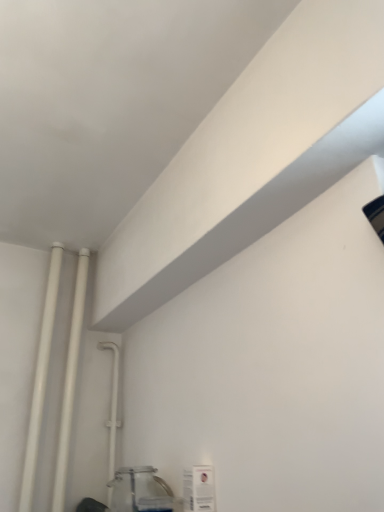
The height and width of the screenshot is (512, 384). What are the coordinates of `clear glass jar at lower left` in the screenshot? It's located at (139, 490).

What is the approximate height of white glossy pipes at left, the 2th pipe when ordered from right to left?

It is 36.51 inches.

Measure the distance between white matte pipe at left, marked as the first pipe in a left-to-right arrangement, and camera.

white matte pipe at left, marked as the first pipe in a left-to-right arrangement, and camera are 1.32 meters apart from each other.

The height and width of the screenshot is (512, 384). Find the location of `white plastic pipe at upper left, placed as the 3th pipe when sorted from left to right`. white plastic pipe at upper left, placed as the 3th pipe when sorted from left to right is located at coordinates (112, 405).

Locate an element on the screen. clear glass jar at lower left is located at coordinates (139, 490).

From a real-world perspective, is white glossy pipes at left, positioned as the second pipe in left-to-right order, over white plastic pipe at upper left, placed as the 3th pipe when sorted from left to right?

Yes.

What's the angular difference between white glossy pipes at left, positioned as the second pipe in left-to-right order, and white plastic pipe at upper left, marked as the first pipe in a right-to-left arrangement,'s facing directions?

The angle between the facing direction of white glossy pipes at left, positioned as the second pipe in left-to-right order, and the facing direction of white plastic pipe at upper left, marked as the first pipe in a right-to-left arrangement, is 2.59 degrees.

Which object is further away from the camera taking this photo, white glossy pipes at left, the 2th pipe when ordered from right to left, or white plastic pipe at upper left, placed as the 3th pipe when sorted from left to right?

white plastic pipe at upper left, placed as the 3th pipe when sorted from left to right, is more distant.

From the picture: Is clear glass jar at lower left situated inside white plastic pipe at upper left, marked as the first pipe in a right-to-left arrangement, or outside?

clear glass jar at lower left is spatially situated outside white plastic pipe at upper left, marked as the first pipe in a right-to-left arrangement.

Does clear glass jar at lower left have a lesser height compared to white plastic pipe at upper left, marked as the first pipe in a right-to-left arrangement?

Yes, clear glass jar at lower left is shorter than white plastic pipe at upper left, marked as the first pipe in a right-to-left arrangement.

Is clear glass jar at lower left bigger than white plastic pipe at upper left, marked as the first pipe in a right-to-left arrangement?

Result: Correct, clear glass jar at lower left is larger in size than white plastic pipe at upper left, marked as the first pipe in a right-to-left arrangement.

Can you confirm if white glossy pipes at left, positioned as the second pipe in left-to-right order, is positioned to the right of clear glass jar at lower left?

Incorrect, white glossy pipes at left, positioned as the second pipe in left-to-right order, is not on the right side of clear glass jar at lower left.

From a real-world perspective, which is physically above, white glossy pipes at left, the 2th pipe when ordered from right to left, or clear glass jar at lower left?

From a 3D spatial view, white glossy pipes at left, the 2th pipe when ordered from right to left, is above.

Can you tell me how much white glossy pipes at left, positioned as the second pipe in left-to-right order, and clear glass jar at lower left differ in facing direction?

88.2 degrees separate the facing orientations of white glossy pipes at left, positioned as the second pipe in left-to-right order, and clear glass jar at lower left.

Are white glossy pipes at left, positioned as the second pipe in left-to-right order, and clear glass jar at lower left making contact?

They are not placed beside each other.

Does white matte pipe at left, marked as the first pipe in a left-to-right arrangement, turn towards white plastic pipe at upper left, placed as the 3th pipe when sorted from left to right?

No, white matte pipe at left, marked as the first pipe in a left-to-right arrangement, is not facing towards white plastic pipe at upper left, placed as the 3th pipe when sorted from left to right.

Is point (34, 443) positioned in front of point (109, 488)?

Yes, it is.

From the image's perspective, which one is positioned lower, white matte pipe at left, marked as the first pipe in a left-to-right arrangement, or white plastic pipe at upper left, placed as the 3th pipe when sorted from left to right?

white plastic pipe at upper left, placed as the 3th pipe when sorted from left to right, is shown below in the image.

Which object is positioned more to the left, white matte pipe at left, marked as the first pipe in a left-to-right arrangement, or white plastic pipe at upper left, marked as the first pipe in a right-to-left arrangement?

From the viewer's perspective, white matte pipe at left, marked as the first pipe in a left-to-right arrangement, appears more on the left side.

Consider the image. Which is less distant, (61, 457) or (40, 413)?

Point (61, 457) is positioned closer to the camera compared to point (40, 413).

Can you tell me how much white glossy pipes at left, positioned as the second pipe in left-to-right order, and white matte pipe at left, the 3th pipe from the right, differ in facing direction?

white glossy pipes at left, positioned as the second pipe in left-to-right order, and white matte pipe at left, the 3th pipe from the right, are facing 0.00184 degrees away from each other.

Is white glossy pipes at left, the 2th pipe when ordered from right to left, positioned with its back to white matte pipe at left, marked as the first pipe in a left-to-right arrangement?

That's not correct — white glossy pipes at left, the 2th pipe when ordered from right to left, is not looking away from white matte pipe at left, marked as the first pipe in a left-to-right arrangement.

Does white glossy pipes at left, the 2th pipe when ordered from right to left, have a larger size compared to white matte pipe at left, marked as the first pipe in a left-to-right arrangement?

Indeed, white glossy pipes at left, the 2th pipe when ordered from right to left, has a larger size compared to white matte pipe at left, marked as the first pipe in a left-to-right arrangement.

How many degrees apart are the facing directions of clear glass jar at lower left and white glossy pipes at left, positioned as the second pipe in left-to-right order?

The facing directions of clear glass jar at lower left and white glossy pipes at left, positioned as the second pipe in left-to-right order, are 88.2 degrees apart.

From a real-world perspective, relative to white glossy pipes at left, the 2th pipe when ordered from right to left, is clear glass jar at lower left vertically above or below?

In terms of real-world spatial position, clear glass jar at lower left is below white glossy pipes at left, the 2th pipe when ordered from right to left.

Is clear glass jar at lower left not close to white glossy pipes at left, positioned as the second pipe in left-to-right order?

No, clear glass jar at lower left is in close proximity to white glossy pipes at left, positioned as the second pipe in left-to-right order.

Considering the sizes of objects clear glass jar at lower left and white glossy pipes at left, positioned as the second pipe in left-to-right order, in the image provided, who is wider, clear glass jar at lower left or white glossy pipes at left, positioned as the second pipe in left-to-right order,?

With larger width is clear glass jar at lower left.

Is white matte pipe at left, marked as the first pipe in a left-to-right arrangement, shorter than white glossy pipes at left, the 2th pipe when ordered from right to left?

Yes, white matte pipe at left, marked as the first pipe in a left-to-right arrangement, is shorter than white glossy pipes at left, the 2th pipe when ordered from right to left.

In the scene shown: Based on their positions, is white matte pipe at left, the 3th pipe from the right, located to the left or right of white glossy pipes at left, positioned as the second pipe in left-to-right order?

Clearly, white matte pipe at left, the 3th pipe from the right, is on the left of white glossy pipes at left, positioned as the second pipe in left-to-right order, in the image.

How much distance is there between white matte pipe at left, the 3th pipe from the right, and white glossy pipes at left, the 2th pipe when ordered from right to left?

white matte pipe at left, the 3th pipe from the right, and white glossy pipes at left, the 2th pipe when ordered from right to left, are 3.46 inches apart.

There is a white matte pipe at left, marked as the first pipe in a left-to-right arrangement. Where is `the 1st pipe below it (from a real-world perspective)`? This screenshot has height=512, width=384. the 1st pipe below it (from a real-world perspective) is located at coordinates (70, 382).

From the image's perspective, count 1st pipes upward from the white plastic pipe at upper left, marked as the first pipe in a right-to-left arrangement, and point to it. Please provide its 2D coordinates.

[(70, 382)]

Find the location of a particular element. This screenshot has height=512, width=384. glass jar located below the white plastic pipe at upper left, marked as the first pipe in a right-to-left arrangement (from the image's perspective) is located at coordinates (139, 490).

In the scene shown: Looking at the image, which one is located further to white matte pipe at left, the 3th pipe from the right, white glossy pipes at left, the 2th pipe when ordered from right to left, or clear glass jar at lower left?

clear glass jar at lower left is positioned further to the anchor white matte pipe at left, the 3th pipe from the right.

Estimate the real-world distances between objects in this image. Which object is further from white plastic pipe at upper left, placed as the 3th pipe when sorted from left to right, white glossy pipes at left, positioned as the second pipe in left-to-right order, or white matte pipe at left, marked as the first pipe in a left-to-right arrangement?

white matte pipe at left, marked as the first pipe in a left-to-right arrangement.

From the image, which object appears to be farther from white plastic pipe at upper left, placed as the 3th pipe when sorted from left to right, white glossy pipes at left, the 2th pipe when ordered from right to left, or clear glass jar at lower left?

Among the two, clear glass jar at lower left is located further to white plastic pipe at upper left, placed as the 3th pipe when sorted from left to right.

Estimate the real-world distances between objects in this image. Which object is closer to clear glass jar at lower left, white glossy pipes at left, positioned as the second pipe in left-to-right order, or white matte pipe at left, marked as the first pipe in a left-to-right arrangement?

Among the two, white glossy pipes at left, positioned as the second pipe in left-to-right order, is located nearer to clear glass jar at lower left.

Based on their spatial positions, is clear glass jar at lower left or white matte pipe at left, the 3th pipe from the right, closer to white glossy pipes at left, the 2th pipe when ordered from right to left?

The object closer to white glossy pipes at left, the 2th pipe when ordered from right to left, is white matte pipe at left, the 3th pipe from the right.

When comparing their distances from white plastic pipe at upper left, placed as the 3th pipe when sorted from left to right, does white matte pipe at left, marked as the first pipe in a left-to-right arrangement, or white glossy pipes at left, positioned as the second pipe in left-to-right order, seem closer?

Among the two, white glossy pipes at left, positioned as the second pipe in left-to-right order, is located nearer to white plastic pipe at upper left, placed as the 3th pipe when sorted from left to right.

Estimate the real-world distances between objects in this image. Which object is closer to clear glass jar at lower left, white matte pipe at left, the 3th pipe from the right, or white glossy pipes at left, positioned as the second pipe in left-to-right order?

white glossy pipes at left, positioned as the second pipe in left-to-right order, is positioned closer to the anchor clear glass jar at lower left.

When comparing their distances from white plastic pipe at upper left, marked as the first pipe in a right-to-left arrangement, does clear glass jar at lower left or white glossy pipes at left, the 2th pipe when ordered from right to left, seem closer?

white glossy pipes at left, the 2th pipe when ordered from right to left.

Where is `pipe between white matte pipe at left, marked as the first pipe in a left-to-right arrangement, and white plastic pipe at upper left, placed as the 3th pipe when sorted from left to right, vertically`? pipe between white matte pipe at left, marked as the first pipe in a left-to-right arrangement, and white plastic pipe at upper left, placed as the 3th pipe when sorted from left to right, vertically is located at coordinates (70, 382).